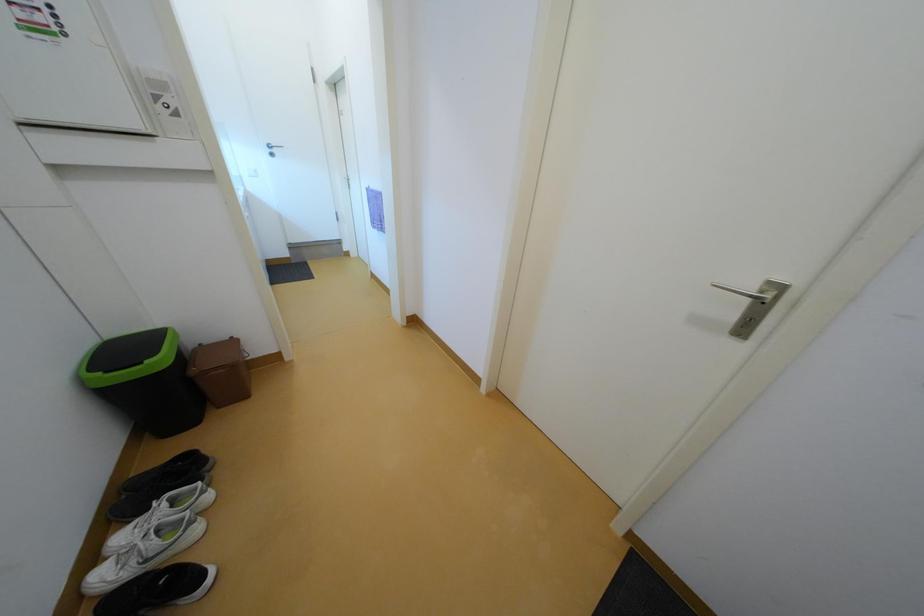
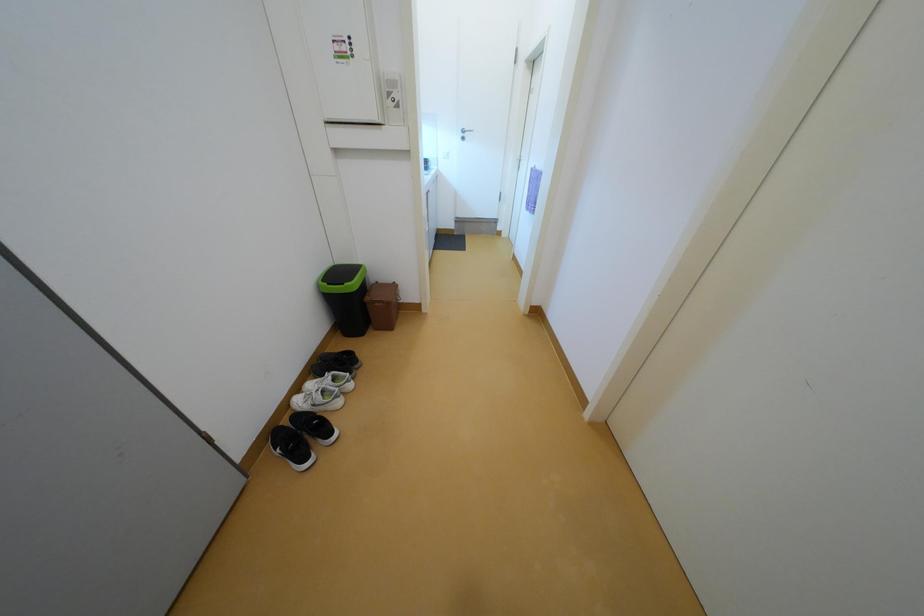
Question: The images are taken continuously from a first-person perspective. In which direction is your viewpoint rotating?

Choices:
 (A) Left
 (B) Right
 (C) Up
 (D) Down

Answer: (A)